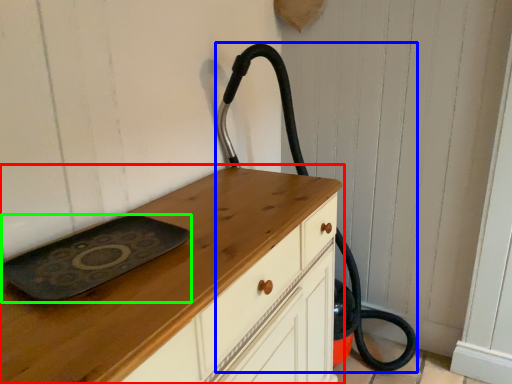
Question: Estimate the real-world distances between objects in this image. Which object is farther from chest of drawers (highlighted by a red box), fire hose (highlighted by a blue box) or tray (highlighted by a green box)?

Choices:
 (A) fire hose
 (B) tray

Answer: (A)